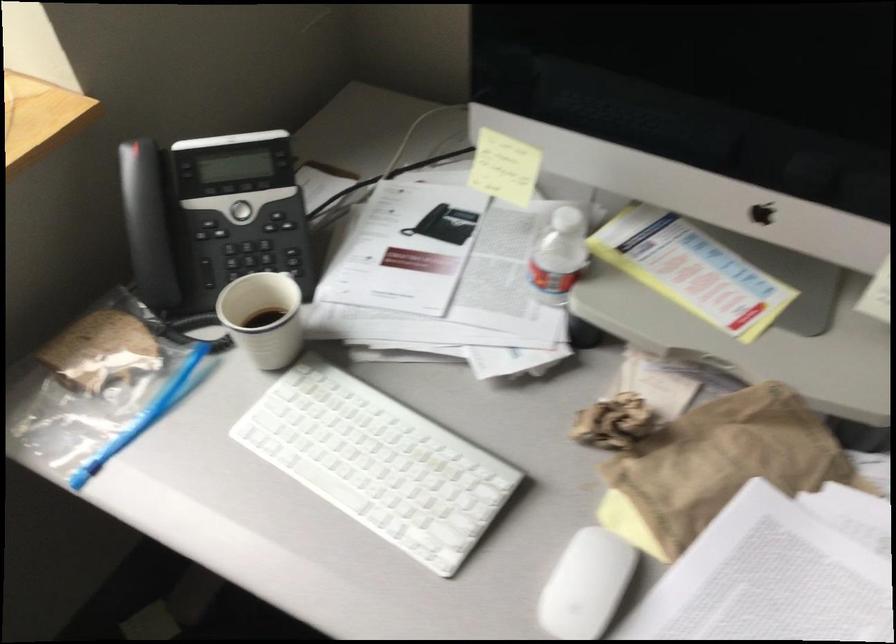
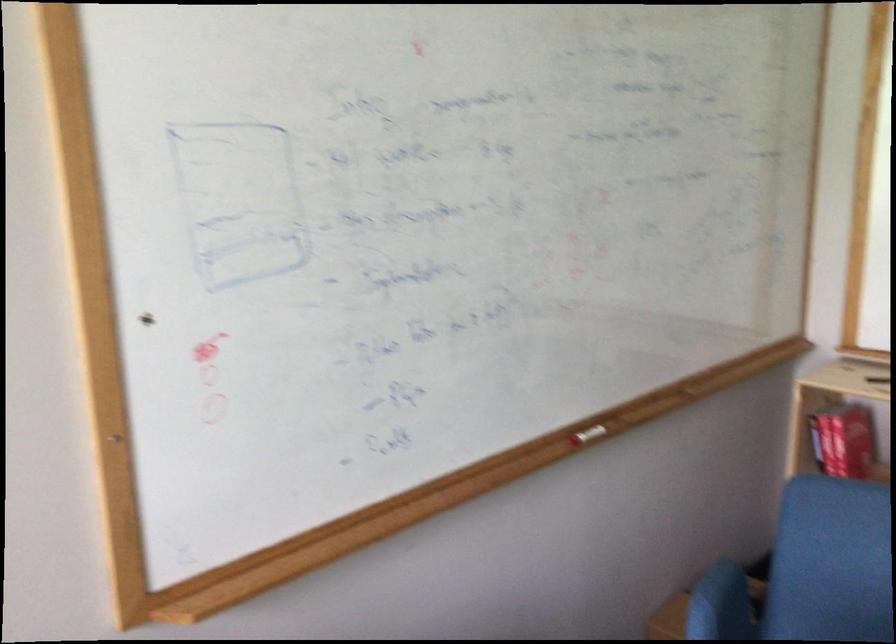
Question: Based on the continuous images, in which direction is the camera rotating? Reply with the corresponding letter.

Choices:
 (A) Left
 (B) Right
 (C) Up
 (D) Down

Answer: (B)